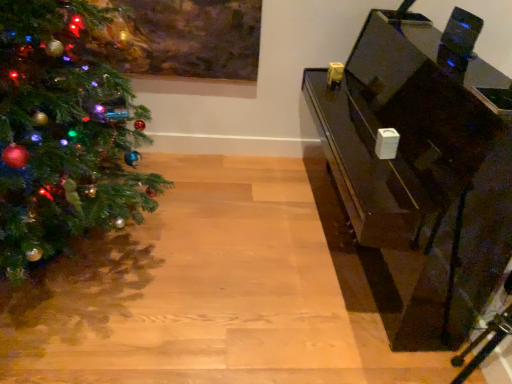
Describe the element at coordinates (63, 134) in the screenshot. The width and height of the screenshot is (512, 384). I see `shiny green christmas tree at left` at that location.

This screenshot has width=512, height=384. I want to click on shiny green christmas tree at left, so click(x=63, y=134).

The height and width of the screenshot is (384, 512). I want to click on glossy black piano at right, so click(422, 171).

Image resolution: width=512 pixels, height=384 pixels. Describe the element at coordinates (422, 171) in the screenshot. I see `glossy black piano at right` at that location.

Where is `shiny green christmas tree at left`? shiny green christmas tree at left is located at coordinates (63, 134).

Considering the positions of objects shiny green christmas tree at left and glossy black piano at right in the image provided, who is more to the left, shiny green christmas tree at left or glossy black piano at right?

shiny green christmas tree at left.

Considering the positions of objects shiny green christmas tree at left and glossy black piano at right in the image provided, who is behind, shiny green christmas tree at left or glossy black piano at right?

glossy black piano at right.

Which is less distant, (131, 216) or (406, 59)?

Point (131, 216) is positioned closer to the camera compared to point (406, 59).

From the image's perspective, is shiny green christmas tree at left on glossy black piano at right?

Yes, from the image's perspective, shiny green christmas tree at left is over glossy black piano at right.

From a real-world perspective, does shiny green christmas tree at left sit lower than glossy black piano at right?

Incorrect, from a real-world perspective, shiny green christmas tree at left is higher than glossy black piano at right.

Looking at their sizes, would you say shiny green christmas tree at left is wider or thinner than glossy black piano at right?

shiny green christmas tree at left is wider than glossy black piano at right.

Does shiny green christmas tree at left have a lesser height compared to glossy black piano at right?

No.

Who is bigger, shiny green christmas tree at left or glossy black piano at right?

shiny green christmas tree at left is bigger.

Which is correct: shiny green christmas tree at left is inside glossy black piano at right, or outside of it?

shiny green christmas tree at left cannot be found inside glossy black piano at right.

Are shiny green christmas tree at left and glossy black piano at right far apart?

shiny green christmas tree at left is far away from glossy black piano at right.

Could you tell me if shiny green christmas tree at left is turned towards glossy black piano at right?

No, shiny green christmas tree at left is not oriented towards glossy black piano at right.

How different are the orientations of shiny green christmas tree at left and glossy black piano at right in degrees?

The angle between the facing direction of shiny green christmas tree at left and the facing direction of glossy black piano at right is 93.1 degrees.

This screenshot has height=384, width=512. In order to click on furniture on the right side of shiny green christmas tree at left in this screenshot , I will do `click(422, 171)`.

Between glossy black piano at right and shiny green christmas tree at left, which one appears on the right side from the viewer's perspective?

glossy black piano at right.

Is glossy black piano at right in front of or behind shiny green christmas tree at left in the image?

In the image, glossy black piano at right appears behind shiny green christmas tree at left.

Does point (472, 188) lie in front of point (51, 187)?

Yes, point (472, 188) is in front of point (51, 187).

From the image's perspective, relative to shiny green christmas tree at left, is glossy black piano at right above or below?

glossy black piano at right is situated lower than shiny green christmas tree at left in the image.

From a real-world perspective, is glossy black piano at right over shiny green christmas tree at left?

Result: No, from a real-world perspective, glossy black piano at right is not above shiny green christmas tree at left.

Which of these two, glossy black piano at right or shiny green christmas tree at left, is thinner?

Thinner between the two is glossy black piano at right.

In the scene shown: Between glossy black piano at right and shiny green christmas tree at left, which one has less height?

With less height is glossy black piano at right.

Does glossy black piano at right have a smaller size compared to shiny green christmas tree at left?

Yes.

Would you say shiny green christmas tree at left is part of glossy black piano at right's contents?

No, glossy black piano at right does not contain shiny green christmas tree at left.

Is glossy black piano at right touching shiny green christmas tree at left?

No.

Is glossy black piano at right turned away from shiny green christmas tree at left?

No.

How many degrees apart are the facing directions of glossy black piano at right and shiny green christmas tree at left?

The facing directions of glossy black piano at right and shiny green christmas tree at left are 93.1 degrees apart.

Where is `furniture lying behind the shiny green christmas tree at left`? furniture lying behind the shiny green christmas tree at left is located at coordinates (422, 171).

The height and width of the screenshot is (384, 512). I want to click on christmas tree lying in front of the glossy black piano at right, so click(63, 134).

Locate an element on the screen. Image resolution: width=512 pixels, height=384 pixels. furniture below the shiny green christmas tree at left (from the image's perspective) is located at coordinates (422, 171).